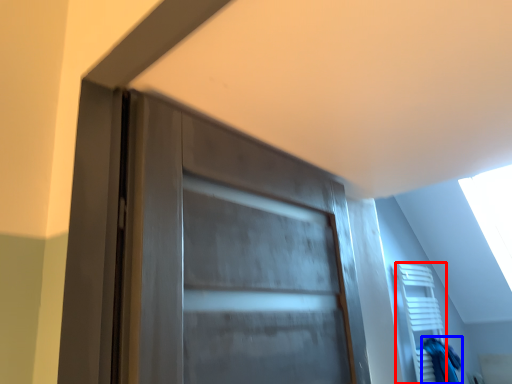
Question: Which object is closer to the camera taking this photo, shelf (highlighted by a red box) or scrub (highlighted by a blue box)?

Choices:
 (A) shelf
 (B) scrub

Answer: (A)